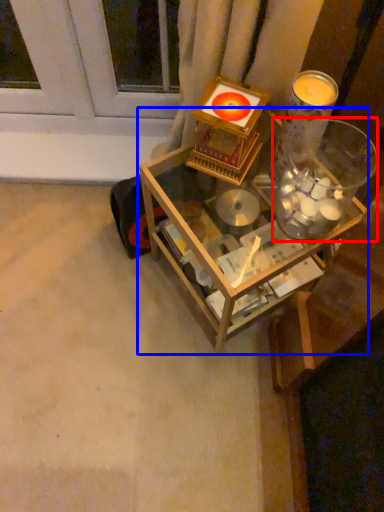
Question: Which of the following is the farthest to the observer, glass jar (highlighted by a red box) or table (highlighted by a blue box)?

Choices:
 (A) glass jar
 (B) table

Answer: (B)